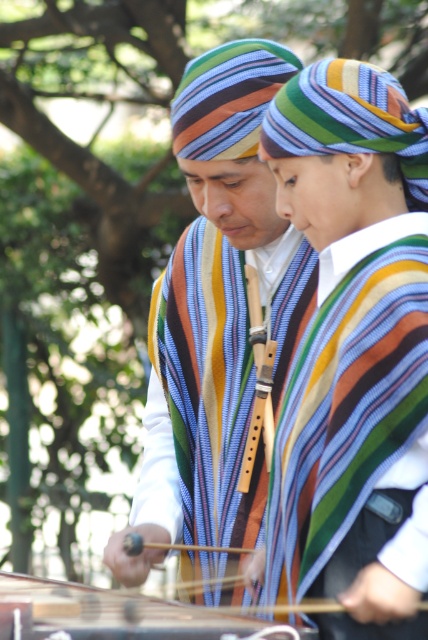
Looking at this image, you are a photographer trying to capture the wooden stringed instrument at center. You notice the striped fabric headscarf at center is blocking your view. Can you confirm if the headscarf is covering the instrument?

Yes, the striped fabric headscarf at center is positioned over the wooden stringed instrument at center, so it is covering the instrument.

You are a photographer trying to capture a clear shot of both the striped fabric headscarf at center and the wooden stringed instrument at center. Since you want both to be fully visible in the frame, which object should you focus on first to ensure it doesn t get cut off?

The striped fabric headscarf at center is much taller than the wooden stringed instrument at center, so you should focus on framing the striped fabric headscarf at center first to ensure its full height fits in the shot.

You are a photographer trying to capture a closeup shot of both the striped fabric headscarf at center and the wooden stringed instrument at center in the scene. What is the minimum distance you need to maintain between the camera and the subjects to ensure both are in focus?

The striped fabric headscarf at center and wooden stringed instrument at center are 23.81 inches apart from each other. To ensure both are in focus, the camera should be positioned at least 23.81 inches away from the closest subject.